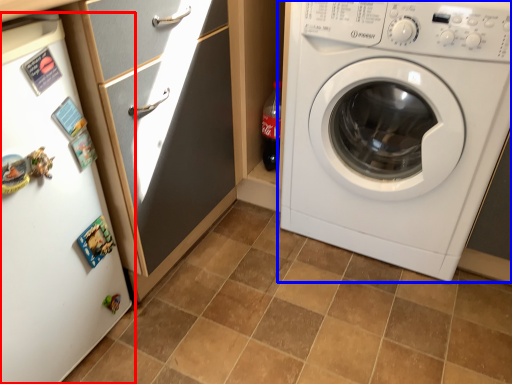
Question: Which of the following is the closest to the observer, fridge (highlighted by a red box) or washing machine (highlighted by a blue box)?

Choices:
 (A) fridge
 (B) washing machine

Answer: (A)